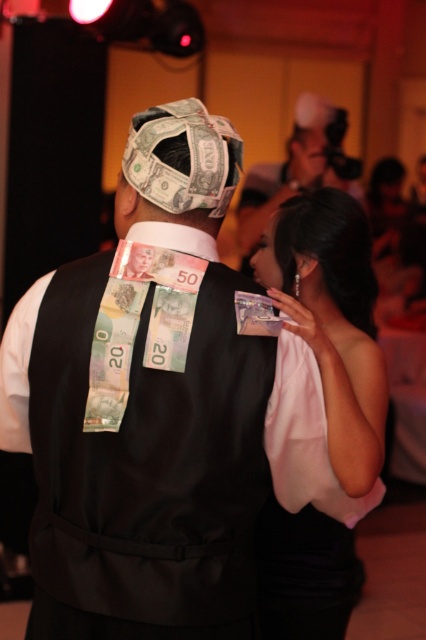
Between matte white hat at upper center and smooth plastic id card at upper center, which one is positioned higher?

matte white hat at upper center is higher up.

Describe the element at coordinates (316, 138) in the screenshot. I see `matte white hat at upper center` at that location.

The height and width of the screenshot is (640, 426). What do you see at coordinates (316, 138) in the screenshot? I see `matte white hat at upper center` at bounding box center [316, 138].

Locate an element on the screen. This screenshot has width=426, height=640. matte white hat at upper center is located at coordinates (316, 138).

In the scene shown: Who is more distant from viewer, [213,182] or [120,248]?

The point [120,248] is more distant.

Is crinkled paper money at center to the right of smooth plastic id card at upper center from the viewer's perspective?

Indeed, crinkled paper money at center is positioned on the right side of smooth plastic id card at upper center.

At what (x,y) coordinates should I click in order to perform the action: click on crinkled paper money at center. Please return your answer as a coordinate pair (x, y). The height and width of the screenshot is (640, 426). Looking at the image, I should click on (181, 170).

This screenshot has height=640, width=426. I want to click on crinkled paper money at center, so [181, 170].

Image resolution: width=426 pixels, height=640 pixels. What do you see at coordinates (299, 166) in the screenshot? I see `shiny metallic headwear at upper center` at bounding box center [299, 166].

Does shiny metallic headwear at upper center appear on the left side of smooth plastic id card at upper center?

Incorrect, shiny metallic headwear at upper center is not on the left side of smooth plastic id card at upper center.

The height and width of the screenshot is (640, 426). What do you see at coordinates (299, 166) in the screenshot?
I see `shiny metallic headwear at upper center` at bounding box center [299, 166].

Identify the location of shiny metallic headwear at upper center. Image resolution: width=426 pixels, height=640 pixels. (299, 166).